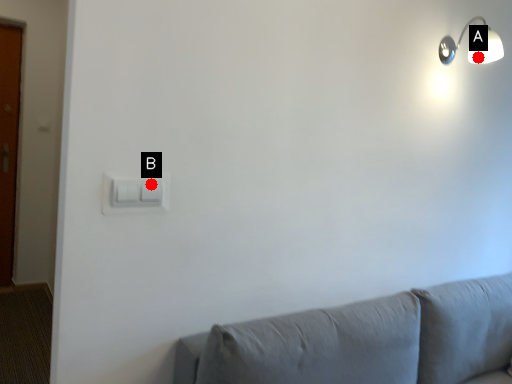
Question: Two points are circled on the image, labeled by A and B beside each circle. Which point is closer to the camera?

Choices:
 (A) A is closer
 (B) B is closer

Answer: (B)